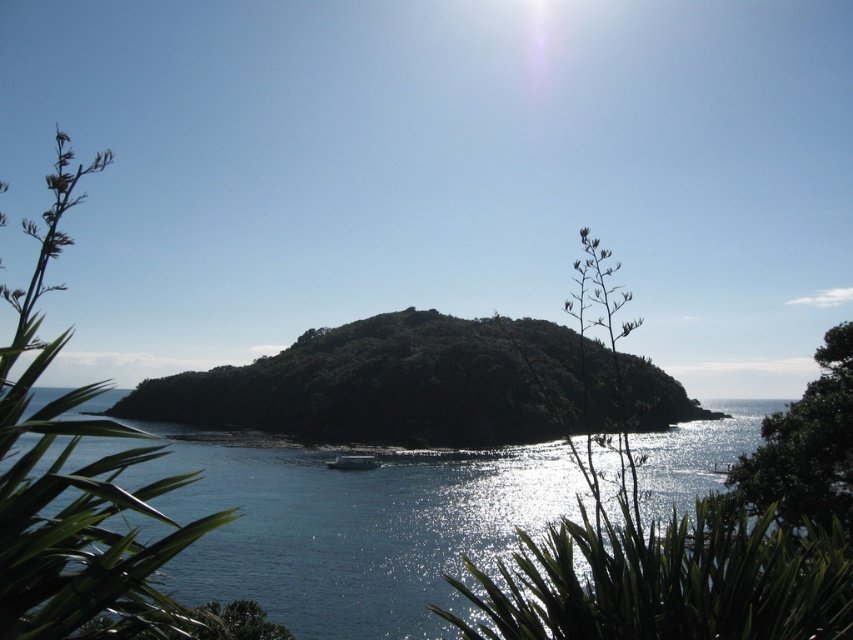
Is point (408, 433) closer to camera compared to point (795, 433)?

No, (408, 433) is behind (795, 433).

Between green leafy island at center and green leafy plant at right, which one appears on the left side from the viewer's perspective?

From the viewer's perspective, green leafy plant at right appears more on the left side.

Find the location of a particular element. Image resolution: width=853 pixels, height=640 pixels. green leafy island at center is located at coordinates (424, 385).

Locate an element on the screen. green leafy island at center is located at coordinates (424, 385).

Which is more to the left, blue liquid water at center or green leafy island at center?

blue liquid water at center is more to the left.

Is blue liquid water at center behind green leafy island at center?

No.

The height and width of the screenshot is (640, 853). In order to click on blue liquid water at center in this screenshot , I will do `click(354, 529)`.

Is blue liquid water at center above green leafy plant at lower center?

Actually, blue liquid water at center is below green leafy plant at lower center.

Which is more to the right, blue liquid water at center or green leafy plant at lower center?

Positioned to the right is blue liquid water at center.

Who is more distant from viewer, (434, 497) or (711, 577)?

Point (434, 497)

I want to click on blue liquid water at center, so click(x=354, y=529).